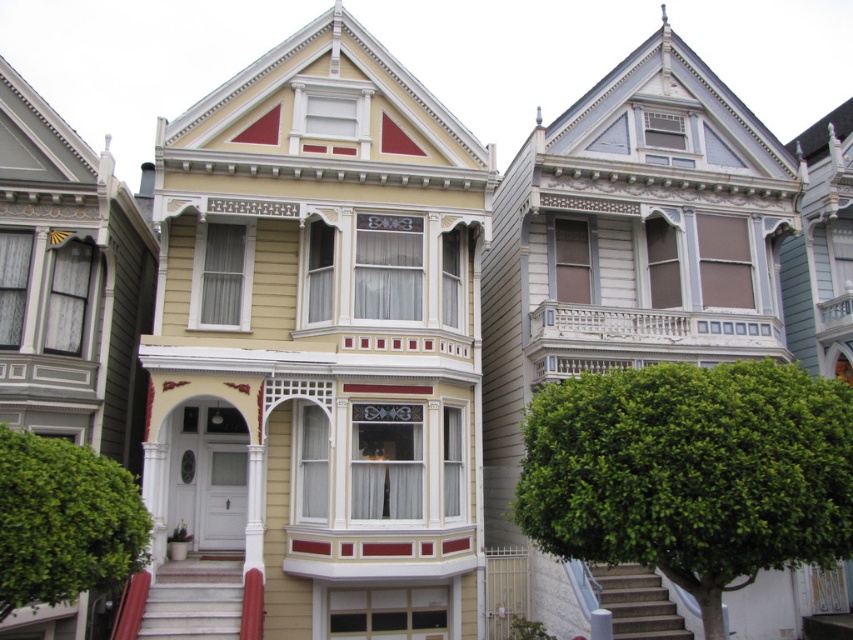
You are standing at the camera position and want to reach the point marked as point (x=228, y=564). If your walking speed is 1.5 meters per second, how many seconds will it take you to reach that point?

The point (x=228, y=564) is 42.90 meters away from the camera. At a walking speed of 1.5 meters per second, it would take approximately 28.6 seconds to reach the point.